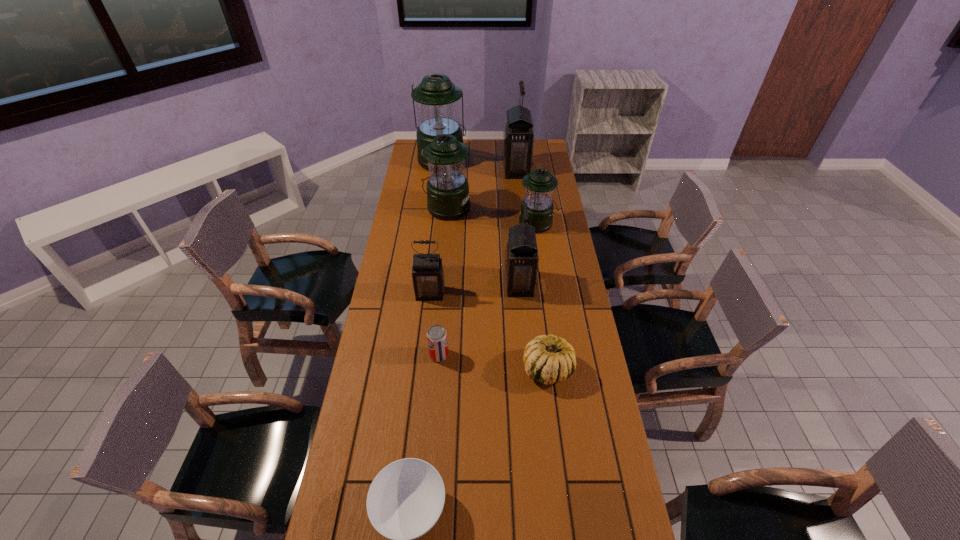
Locate an element on the screen. The image size is (960, 540). the farthest green lantern is located at coordinates click(436, 97).

This screenshot has width=960, height=540. In order to click on the biggest gray lantern in this screenshot , I will do `click(518, 138)`.

Where is `the second biggest green lantern`? The width and height of the screenshot is (960, 540). the second biggest green lantern is located at coordinates (447, 192).

The image size is (960, 540). In order to click on the second smallest gray lantern in this screenshot , I will do coord(521,254).

I want to click on the leftmost gray lantern, so click(x=428, y=279).

The width and height of the screenshot is (960, 540). In order to click on the smallest green lantern in this screenshot , I will do `click(539, 185)`.

At what (x,y) coordinates should I click in order to perform the action: click on white gourd. Please return your answer as a coordinate pair (x, y). Image resolution: width=960 pixels, height=540 pixels. Looking at the image, I should click on (547, 359).

This screenshot has width=960, height=540. Identify the location of soda. (437, 339).

Identify the location of vacant space located on the front of the farthest green lantern. This screenshot has width=960, height=540. (437, 208).

Identify the location of vacant position located 0.050m on the front-facing side of the farthest gray lantern. The width and height of the screenshot is (960, 540). (492, 170).